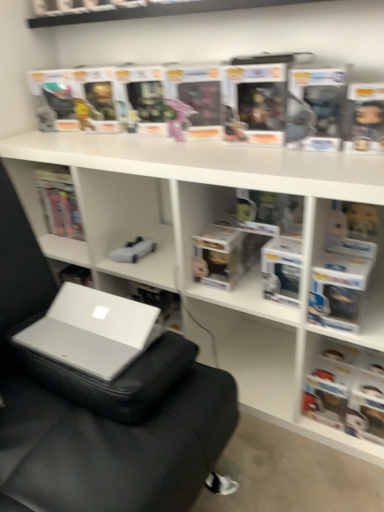
Where is `gray fabric bean bag chair at center`? The width and height of the screenshot is (384, 512). gray fabric bean bag chair at center is located at coordinates (98, 407).

Measure the distance between point [327,341] and camera.

Point [327,341] is 4.06 feet away from camera.

Image resolution: width=384 pixels, height=512 pixels. What do you see at coordinates (91, 331) in the screenshot?
I see `silver/glossy laptop at lower left` at bounding box center [91, 331].

Locate an element on the screen. gray fabric bean bag chair at center is located at coordinates (98, 407).

Is silver/glossy laptop at lower left further to the viewer compared to gray fabric bean bag chair at center?

Yes, silver/glossy laptop at lower left is further from the camera.

From a real-world perspective, between silver/glossy laptop at lower left and gray fabric bean bag chair at center, who is vertically higher?

From a 3D spatial view, silver/glossy laptop at lower left is above.

From the image's perspective, which is above, silver/glossy laptop at lower left or gray fabric bean bag chair at center?

gray fabric bean bag chair at center appears higher in the image.

Considering the sizes of silver/glossy laptop at lower left and gray fabric bean bag chair at center in the image, is silver/glossy laptop at lower left bigger or smaller than gray fabric bean bag chair at center?

Clearly, silver/glossy laptop at lower left is smaller in size than gray fabric bean bag chair at center.

The height and width of the screenshot is (512, 384). I want to click on book that is below the gray fabric bean bag chair at center (from the image's perspective), so click(x=346, y=392).

Considering the positions of objects gray fabric bean bag chair at center and matte black book at right in the image provided, who is in front, gray fabric bean bag chair at center or matte black book at right?

gray fabric bean bag chair at center.

Is gray fabric bean bag chair at center directly adjacent to matte black book at right?

gray fabric bean bag chair at center is not next to matte black book at right, and they're not touching.

Which of these two, gray fabric bean bag chair at center or silver/glossy laptop at lower left, is wider?

Wider between the two is gray fabric bean bag chair at center.

Can you tell me how much gray fabric bean bag chair at center and silver/glossy laptop at lower left differ in facing direction?

gray fabric bean bag chair at center and silver/glossy laptop at lower left are facing 90.5 degrees away from each other.

Is gray fabric bean bag chair at center in contact with silver/glossy laptop at lower left?

No, gray fabric bean bag chair at center is not next to silver/glossy laptop at lower left.

Between gray fabric bean bag chair at center and silver/glossy laptop at lower left, which one has smaller size?

silver/glossy laptop at lower left is smaller.

How many degrees apart are the facing directions of silver/glossy laptop at lower left and matte black book at right?

90 degrees.

Is silver/glossy laptop at lower left next to matte black book at right and touching it?

There is a gap between silver/glossy laptop at lower left and matte black book at right.

Does point (120, 320) come behind point (382, 444)?

No.

Which of these two, matte black book at right or silver/glossy laptop at lower left, is bigger?

Bigger between the two is matte black book at right.

Is matte black book at right not near silver/glossy laptop at lower left?

No.

From the image's perspective, does matte black book at right appear lower than silver/glossy laptop at lower left?

Correct, matte black book at right appears lower than silver/glossy laptop at lower left in the image.

Is silver/glossy laptop at lower left at the back of matte black book at right?

That's not correct — matte black book at right is not looking away from silver/glossy laptop at lower left.

Is matte black book at right further to camera compared to gray fabric bean bag chair at center?

Yes, matte black book at right is behind gray fabric bean bag chair at center.

In the scene shown: Is matte black book at right inside the boundaries of gray fabric bean bag chair at center, or outside?

matte black book at right fits inside gray fabric bean bag chair at center.

How different are the orientations of matte black book at right and gray fabric bean bag chair at center in degrees?

The angle between the facing direction of matte black book at right and the facing direction of gray fabric bean bag chair at center is 0.503 degrees.

From the picture: Does matte black book at right have a larger size compared to gray fabric bean bag chair at center?

No.

Image resolution: width=384 pixels, height=512 pixels. I want to click on laptop on the left side of gray fabric bean bag chair at center, so click(91, 331).

Find the location of `book below the gray fabric bean bag chair at center (from a real-world perspective)`. book below the gray fabric bean bag chair at center (from a real-world perspective) is located at coordinates (346, 392).

Estimate the real-world distances between objects in this image. Which object is further from silver/glossy laptop at lower left, matte black book at right or gray fabric bean bag chair at center?

The object further to silver/glossy laptop at lower left is matte black book at right.

Looking at the image, which one is located closer to gray fabric bean bag chair at center, matte black book at right or silver/glossy laptop at lower left?

Based on the image, silver/glossy laptop at lower left appears to be nearer to gray fabric bean bag chair at center.

Which object lies further to the anchor point gray fabric bean bag chair at center, silver/glossy laptop at lower left or matte black book at right?

matte black book at right lies further to gray fabric bean bag chair at center than the other object.

Considering their positions, is gray fabric bean bag chair at center positioned further to silver/glossy laptop at lower left than matte black book at right?

matte black book at right.

Looking at the image, which one is located closer to matte black book at right, silver/glossy laptop at lower left or gray fabric bean bag chair at center?

gray fabric bean bag chair at center is positioned closer to the anchor matte black book at right.

From the picture: Considering their positions, is gray fabric bean bag chair at center positioned closer to matte black book at right than silver/glossy laptop at lower left?

gray fabric bean bag chair at center.

Where is `bean bag chair situated between silver/glossy laptop at lower left and matte black book at right from left to right`? This screenshot has height=512, width=384. bean bag chair situated between silver/glossy laptop at lower left and matte black book at right from left to right is located at coordinates (98, 407).